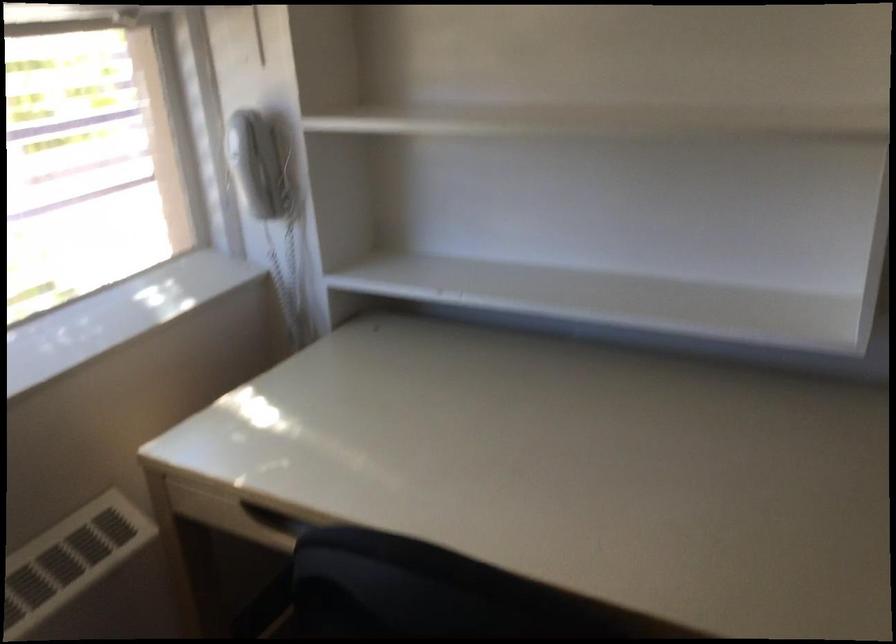
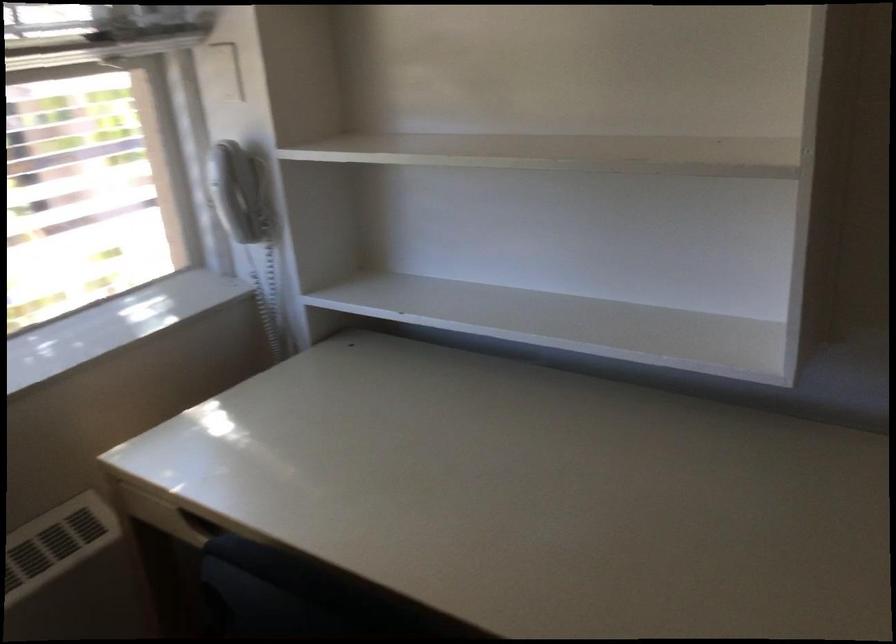
Locate, in the second image, the point that corresponds to [252,163] in the first image.

(230, 190)